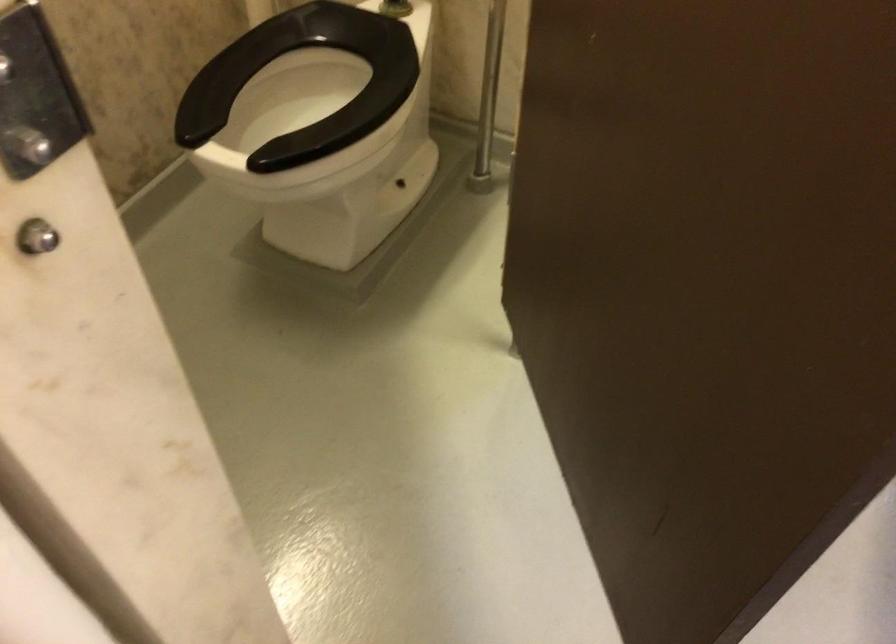
The first image is from the beginning of the video and the second image is from the end. How did the camera likely rotate when shooting the video?

The camera's rotation is toward left-down.